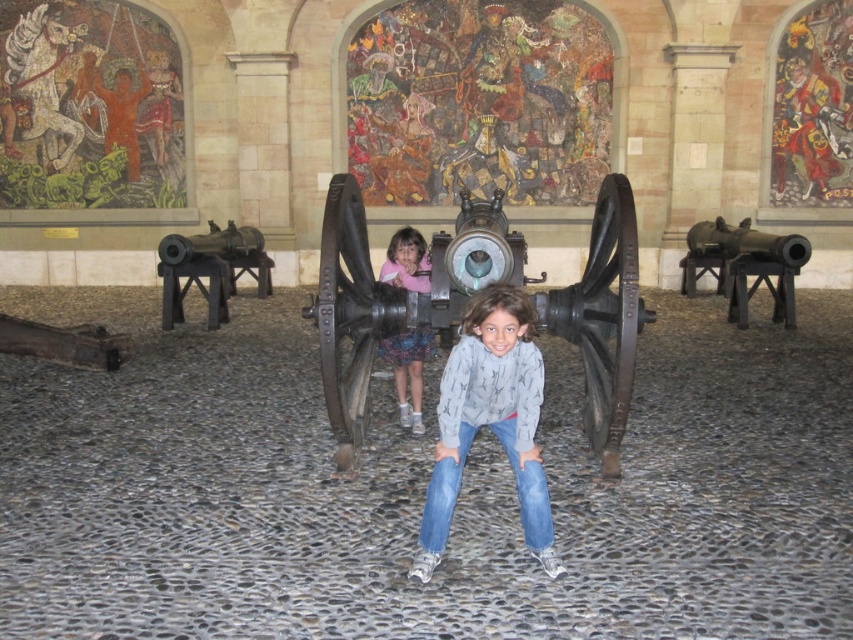
Question: Which point appears farthest from the camera in this image?

Choices:
 (A) (436, 486)
 (B) (606, 204)

Answer: (B)

Question: Is polished bronze cannon at center positioned before polished bronze cannon at right?

Choices:
 (A) yes
 (B) no

Answer: (A)

Question: Which object is positioned farthest from the polished bronze cannon at center?

Choices:
 (A) polished bronze cannon at right
 (B) blue denim jeans at center

Answer: (A)

Question: Can you confirm if polished bronze cannon at center is positioned to the right of polished bronze cannon at right?

Choices:
 (A) no
 (B) yes

Answer: (A)

Question: Can you confirm if polished bronze cannon at center is positioned above pink fabric dress at center?

Choices:
 (A) no
 (B) yes

Answer: (B)

Question: Estimate the real-world distances between objects in this image. Which object is closer to the polished bronze cannon at center?

Choices:
 (A) polished bronze cannon at right
 (B) blue denim jeans at center
 (C) pink fabric dress at center

Answer: (C)